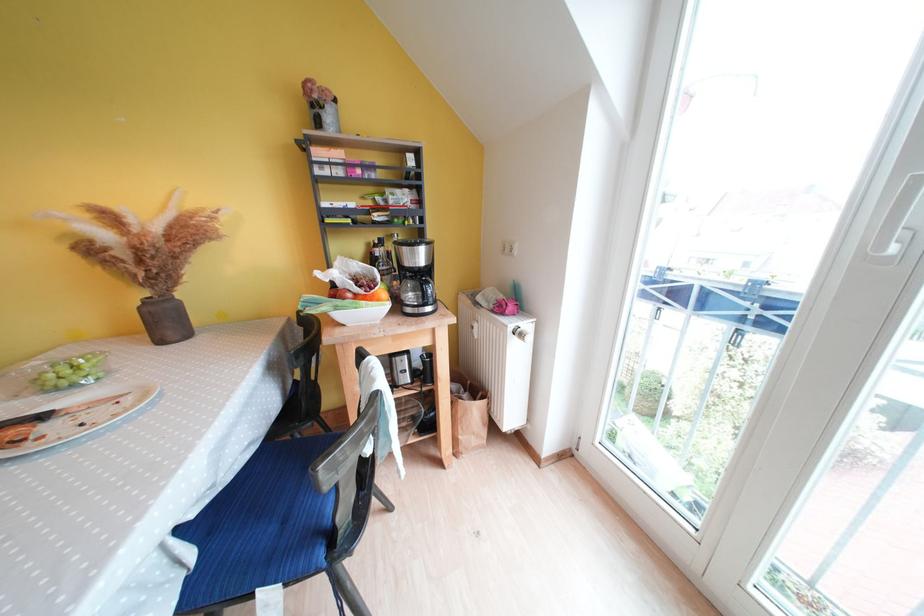
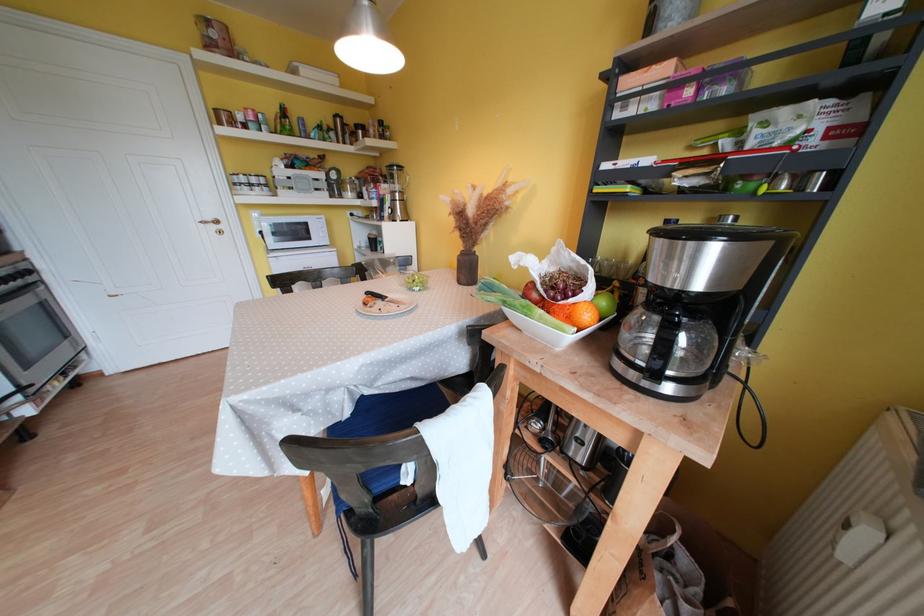
Where in the second image is the point corresponding to [419,272] from the first image?

(669, 292)